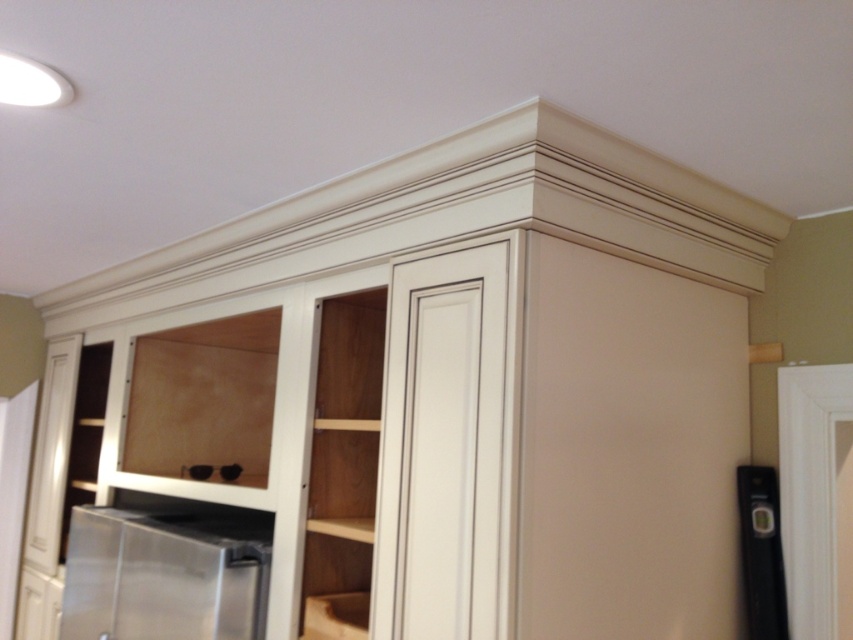
Question: Can you confirm if stainless steel refrigerator at lower left is positioned to the left of black plastic level at lower right?

Choices:
 (A) no
 (B) yes

Answer: (B)

Question: Can you confirm if stainless steel refrigerator at lower left is thinner than black plastic level at lower right?

Choices:
 (A) no
 (B) yes

Answer: (A)

Question: Among these objects, which one is farthest from the camera?

Choices:
 (A) stainless steel refrigerator at lower left
 (B) black plastic level at lower right

Answer: (A)

Question: Which point appears farthest from the camera in this image?

Choices:
 (A) click(755, 586)
 (B) click(88, 570)

Answer: (B)

Question: Among these points, which one is farthest from the camera?

Choices:
 (A) (140, 579)
 (B) (780, 586)

Answer: (A)

Question: Does stainless steel refrigerator at lower left appear under black plastic level at lower right?

Choices:
 (A) yes
 (B) no

Answer: (A)